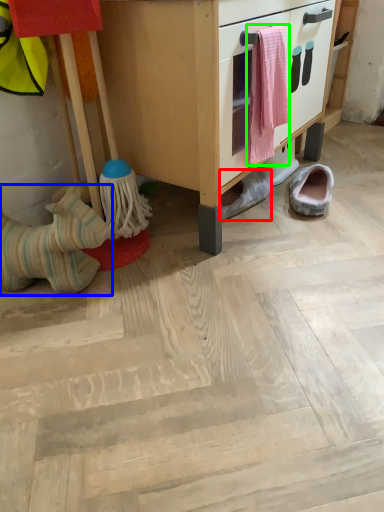
Question: Estimate the real-world distances between objects in this image. Which object is closer to footwear (highlighted by a red box), footwear (highlighted by a blue box) or laundry (highlighted by a green box)?

Choices:
 (A) footwear
 (B) laundry

Answer: (B)